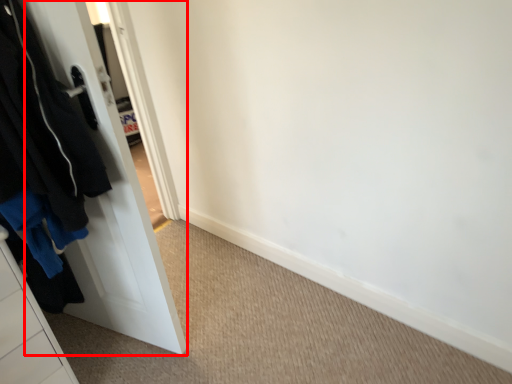
Question: Where is door (annotated by the red box) located in relation to clothing in the image?

Choices:
 (A) right
 (B) left

Answer: (A)